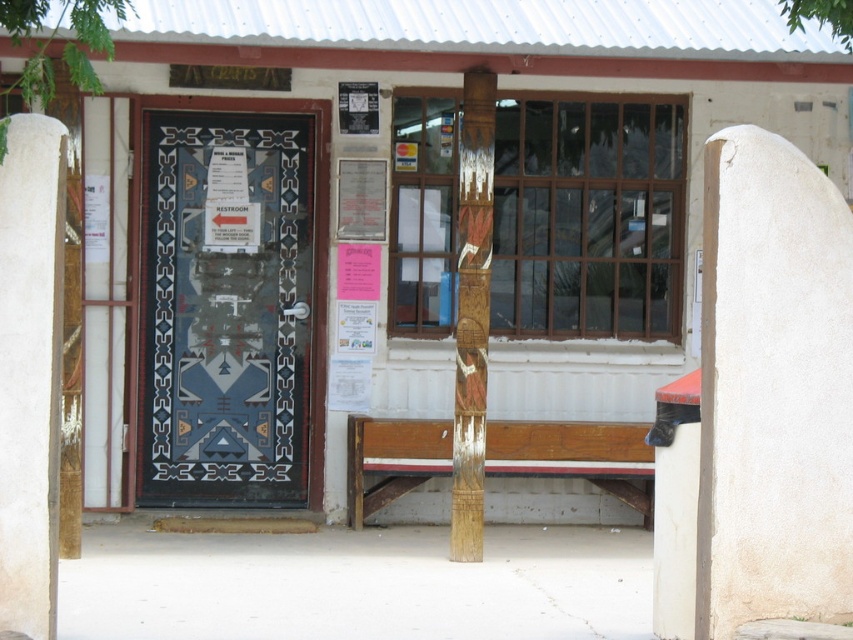
Question: Which object appears farthest from the camera in this image?

Choices:
 (A) decorative glass door at center
 (B) wooden totem pole at center

Answer: (A)

Question: Is decorative glass door at center above wooden totem pole at center?

Choices:
 (A) no
 (B) yes

Answer: (B)

Question: Is decorative glass door at center in front of wooden totem pole at center?

Choices:
 (A) no
 (B) yes

Answer: (A)

Question: Which point is closer to the camera?

Choices:
 (A) decorative glass door at center
 (B) wooden bench at center

Answer: (B)

Question: Does decorative glass door at center have a lesser width compared to white stucco pillar at center?

Choices:
 (A) yes
 (B) no

Answer: (B)

Question: Which of the following is the closest to the observer?

Choices:
 (A) wooden bench at center
 (B) white stucco pillar at center
 (C) decorative glass door at center

Answer: (B)